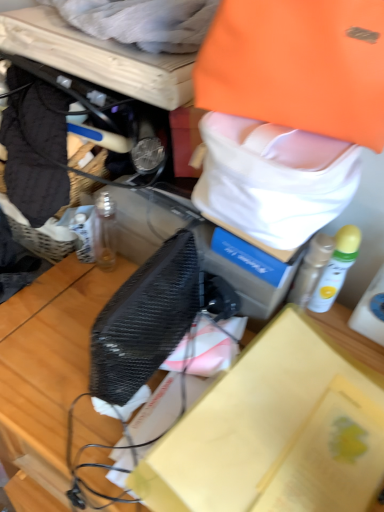
At what (x,y) coordinates should I click in order to perform the action: click on free space to the left of black mesh box at center. Please return your answer as a coordinate pair (x, y). The height and width of the screenshot is (512, 384). Looking at the image, I should click on (71, 377).